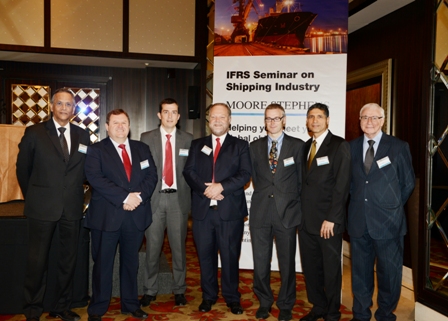
Find the location of `wall`. wall is located at coordinates (140, 86).